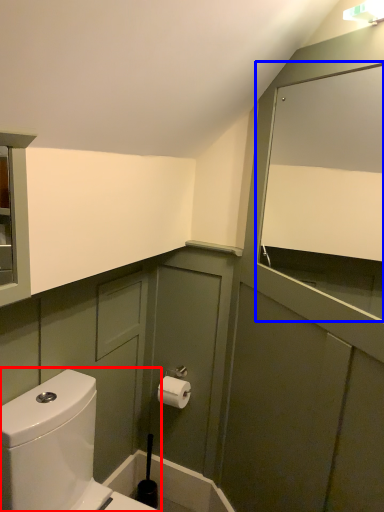
Question: Which object is closer to the camera taking this photo, toilet (highlighted by a red box) or mirror (highlighted by a blue box)?

Choices:
 (A) toilet
 (B) mirror

Answer: (B)